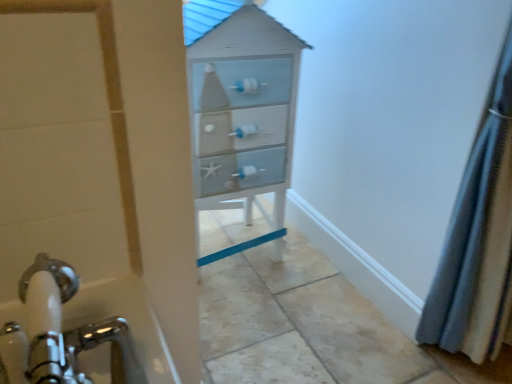
Question: Considering the positions of gray fabric shower curtain at right and light blue painted wood chest of drawers at center in the image, is gray fabric shower curtain at right bigger or smaller than light blue painted wood chest of drawers at center?

Choices:
 (A) small
 (B) big

Answer: (A)

Question: From the image's perspective, relative to light blue painted wood chest of drawers at center, is gray fabric shower curtain at right above or below?

Choices:
 (A) below
 (B) above

Answer: (A)

Question: Is gray fabric shower curtain at right taller or shorter than light blue painted wood chest of drawers at center?

Choices:
 (A) tall
 (B) short

Answer: (A)

Question: Looking at the image, does light blue painted wood chest of drawers at center seem bigger or smaller compared to gray fabric shower curtain at right?

Choices:
 (A) small
 (B) big

Answer: (B)

Question: Is point (220, 76) positioned closer to the camera than point (481, 347)?

Choices:
 (A) farther
 (B) closer

Answer: (A)

Question: Considering the relative positions of light blue painted wood chest of drawers at center and gray fabric shower curtain at right in the image provided, is light blue painted wood chest of drawers at center to the left or to the right of gray fabric shower curtain at right?

Choices:
 (A) right
 (B) left

Answer: (B)

Question: In the image, is light blue painted wood chest of drawers at center positioned in front of or behind gray fabric shower curtain at right?

Choices:
 (A) front
 (B) behind

Answer: (B)